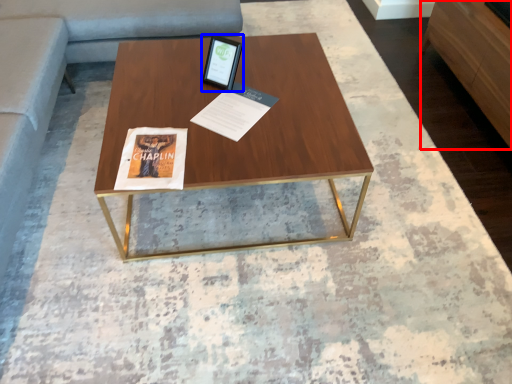
Question: Among these objects, which one is farthest to the camera, furniture (highlighted by a red box) or tablet computer (highlighted by a blue box)?

Choices:
 (A) furniture
 (B) tablet computer

Answer: (A)